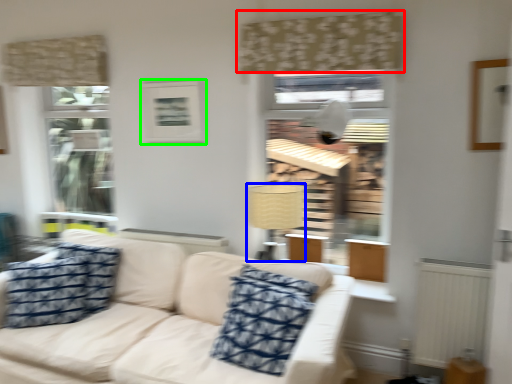
Question: Which object is positioned closest to curtain (highlighted by a red box)? Select from lamp (highlighted by a blue box) and picture frame (highlighted by a green box).

Choices:
 (A) lamp
 (B) picture frame

Answer: (B)